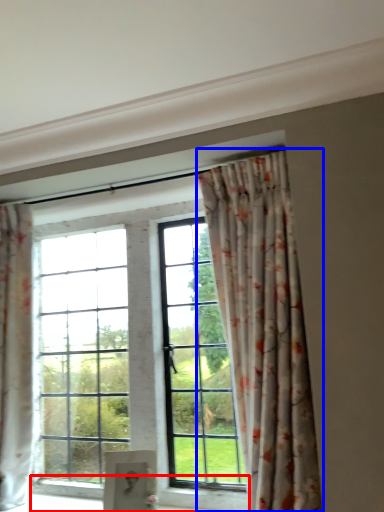
Question: Among these objects, which one is farthest to the camera, window sill (highlighted by a red box) or curtain (highlighted by a blue box)?

Choices:
 (A) window sill
 (B) curtain

Answer: (A)